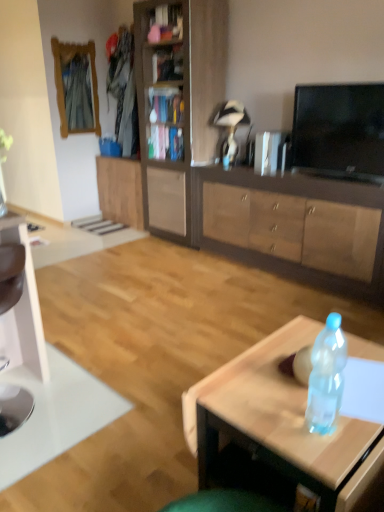
Locate an element on the screen. This screenshot has width=384, height=512. free space to the right of white glossy computer desk at left is located at coordinates (93, 404).